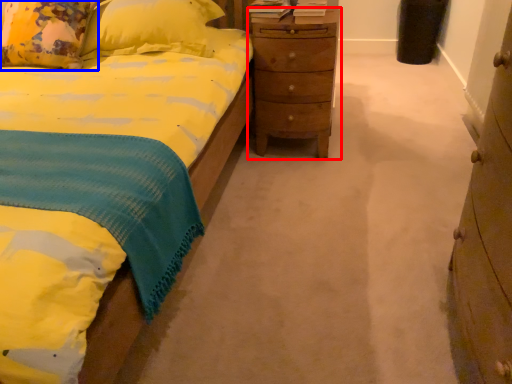
Question: Among these objects, which one is nearest to the camera, nightstand (highlighted by a red box) or pillow (highlighted by a blue box)?

Choices:
 (A) nightstand
 (B) pillow

Answer: (B)